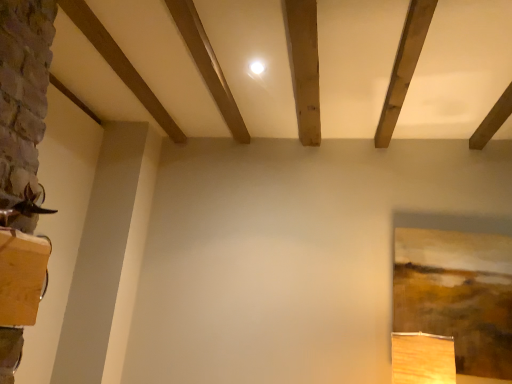
The width and height of the screenshot is (512, 384). What do you see at coordinates (208, 65) in the screenshot?
I see `smooth wooden plank at upper left, marked as the 2th plank in a left-to-right arrangement` at bounding box center [208, 65].

Find the location of a particular element. smooth wooden plank at upper left, marked as the 2th plank in a left-to-right arrangement is located at coordinates (208, 65).

The height and width of the screenshot is (384, 512). Identify the location of wooden beam at upper left, which appears as the first plank when viewed from the left. (120, 63).

What do you see at coordinates (120, 63) in the screenshot? I see `wooden beam at upper left, which appears as the second plank when viewed from the right` at bounding box center [120, 63].

The image size is (512, 384). I want to click on smooth wooden plank at upper left, the first plank in the right-to-left sequence, so click(x=208, y=65).

Is smooth wooden plank at upper left, the first plank in the right-to-left sequence, at the right side of wooden beam at upper left, which appears as the first plank when viewed from the left?

Correct, you'll find smooth wooden plank at upper left, the first plank in the right-to-left sequence, to the right of wooden beam at upper left, which appears as the first plank when viewed from the left.

From the picture: Between smooth wooden plank at upper left, the first plank in the right-to-left sequence, and wooden beam at upper left, which appears as the second plank when viewed from the right, which one is positioned in front?

smooth wooden plank at upper left, the first plank in the right-to-left sequence, is more forward.

Considering the points (199, 66) and (129, 65), which point is behind, point (199, 66) or point (129, 65)?

The point (129, 65) is farther.

From the image's perspective, is smooth wooden plank at upper left, the first plank in the right-to-left sequence, above wooden beam at upper left, which appears as the first plank when viewed from the left?

No.

From a real-world perspective, is smooth wooden plank at upper left, marked as the 2th plank in a left-to-right arrangement, beneath wooden beam at upper left, which appears as the second plank when viewed from the right?

Actually, smooth wooden plank at upper left, marked as the 2th plank in a left-to-right arrangement, is physically above wooden beam at upper left, which appears as the second plank when viewed from the right, in the real world.

Between smooth wooden plank at upper left, the first plank in the right-to-left sequence, and wooden beam at upper left, which appears as the first plank when viewed from the left, which one has smaller width?

smooth wooden plank at upper left, the first plank in the right-to-left sequence.

Is smooth wooden plank at upper left, marked as the 2th plank in a left-to-right arrangement, taller than wooden beam at upper left, which appears as the first plank when viewed from the left?

In fact, smooth wooden plank at upper left, marked as the 2th plank in a left-to-right arrangement, may be shorter than wooden beam at upper left, which appears as the first plank when viewed from the left.

Does smooth wooden plank at upper left, the first plank in the right-to-left sequence, have a larger size compared to wooden beam at upper left, which appears as the first plank when viewed from the left?

No, smooth wooden plank at upper left, the first plank in the right-to-left sequence, is not bigger than wooden beam at upper left, which appears as the first plank when viewed from the left.

Is smooth wooden plank at upper left, the first plank in the right-to-left sequence, surrounding wooden beam at upper left, which appears as the second plank when viewed from the right?

That's incorrect, wooden beam at upper left, which appears as the second plank when viewed from the right, is not inside smooth wooden plank at upper left, the first plank in the right-to-left sequence.

Is smooth wooden plank at upper left, marked as the 2th plank in a left-to-right arrangement, positioned far away from wooden beam at upper left, which appears as the first plank when viewed from the left?

smooth wooden plank at upper left, marked as the 2th plank in a left-to-right arrangement, is near wooden beam at upper left, which appears as the first plank when viewed from the left, not far away.

Is smooth wooden plank at upper left, the first plank in the right-to-left sequence, oriented towards wooden beam at upper left, which appears as the first plank when viewed from the left?

Yes, smooth wooden plank at upper left, the first plank in the right-to-left sequence, is facing wooden beam at upper left, which appears as the first plank when viewed from the left.

What's the angular difference between smooth wooden plank at upper left, the first plank in the right-to-left sequence, and wooden beam at upper left, which appears as the second plank when viewed from the right,'s facing directions?

0.273 degrees.

Measure the distance between smooth wooden plank at upper left, marked as the 2th plank in a left-to-right arrangement, and wooden beam at upper left, which appears as the second plank when viewed from the right.

16.23 inches.

Find the location of `plank positioned vertically above the wooden beam at upper left, which appears as the second plank when viewed from the right (from a real-world perspective)`. plank positioned vertically above the wooden beam at upper left, which appears as the second plank when viewed from the right (from a real-world perspective) is located at coordinates (208, 65).

In the scene shown: In the image, is wooden beam at upper left, which appears as the second plank when viewed from the right, on the left side or the right side of smooth wooden plank at upper left, marked as the 2th plank in a left-to-right arrangement?

From the image, it's evident that wooden beam at upper left, which appears as the second plank when viewed from the right, is to the left of smooth wooden plank at upper left, marked as the 2th plank in a left-to-right arrangement.

Considering their positions, is wooden beam at upper left, which appears as the first plank when viewed from the left, located in front of or behind smooth wooden plank at upper left, marked as the 2th plank in a left-to-right arrangement?

In the image, wooden beam at upper left, which appears as the first plank when viewed from the left, appears behind smooth wooden plank at upper left, marked as the 2th plank in a left-to-right arrangement.

Which is farther from the camera, (156, 105) or (225, 83)?

The point (156, 105) is more distant.

From the image's perspective, which is above, wooden beam at upper left, which appears as the second plank when viewed from the right, or smooth wooden plank at upper left, marked as the 2th plank in a left-to-right arrangement?

wooden beam at upper left, which appears as the second plank when viewed from the right, from the image's perspective.

From a real-world perspective, which is physically above, wooden beam at upper left, which appears as the first plank when viewed from the left, or smooth wooden plank at upper left, the first plank in the right-to-left sequence?

In real-world perspective, smooth wooden plank at upper left, the first plank in the right-to-left sequence, is above.

Considering the sizes of wooden beam at upper left, which appears as the second plank when viewed from the right, and smooth wooden plank at upper left, marked as the 2th plank in a left-to-right arrangement, in the image, is wooden beam at upper left, which appears as the second plank when viewed from the right, wider or thinner than smooth wooden plank at upper left, marked as the 2th plank in a left-to-right arrangement,?

Clearly, wooden beam at upper left, which appears as the second plank when viewed from the right, has more width compared to smooth wooden plank at upper left, marked as the 2th plank in a left-to-right arrangement.

Which of these two, wooden beam at upper left, which appears as the first plank when viewed from the left, or smooth wooden plank at upper left, marked as the 2th plank in a left-to-right arrangement, stands shorter?

With less height is smooth wooden plank at upper left, marked as the 2th plank in a left-to-right arrangement.

Does wooden beam at upper left, which appears as the second plank when viewed from the right, have a larger size compared to smooth wooden plank at upper left, marked as the 2th plank in a left-to-right arrangement?

Indeed, wooden beam at upper left, which appears as the second plank when viewed from the right, has a larger size compared to smooth wooden plank at upper left, marked as the 2th plank in a left-to-right arrangement.

Would you say wooden beam at upper left, which appears as the second plank when viewed from the right, is outside smooth wooden plank at upper left, the first plank in the right-to-left sequence?

Indeed, wooden beam at upper left, which appears as the second plank when viewed from the right, is completely outside smooth wooden plank at upper left, the first plank in the right-to-left sequence.

Is wooden beam at upper left, which appears as the second plank when viewed from the right, not close to smooth wooden plank at upper left, the first plank in the right-to-left sequence?

wooden beam at upper left, which appears as the second plank when viewed from the right, is actually quite close to smooth wooden plank at upper left, the first plank in the right-to-left sequence.

Could you tell me if wooden beam at upper left, which appears as the first plank when viewed from the left, is facing smooth wooden plank at upper left, marked as the 2th plank in a left-to-right arrangement?

Yes, wooden beam at upper left, which appears as the first plank when viewed from the left, is turned towards smooth wooden plank at upper left, marked as the 2th plank in a left-to-right arrangement.

How many degrees apart are the facing directions of wooden beam at upper left, which appears as the second plank when viewed from the right, and smooth wooden plank at upper left, the first plank in the right-to-left sequence?

0.273 degrees.

At what (x,y) coordinates should I click in order to perform the action: click on plank lying on the right of wooden beam at upper left, which appears as the first plank when viewed from the left. Please return your answer as a coordinate pair (x, y). Looking at the image, I should click on (208, 65).

I want to click on plank behind the smooth wooden plank at upper left, the first plank in the right-to-left sequence, so click(120, 63).

What are the coordinates of `plank above the wooden beam at upper left, which appears as the first plank when viewed from the left (from a real-world perspective)` in the screenshot? It's located at (208, 65).